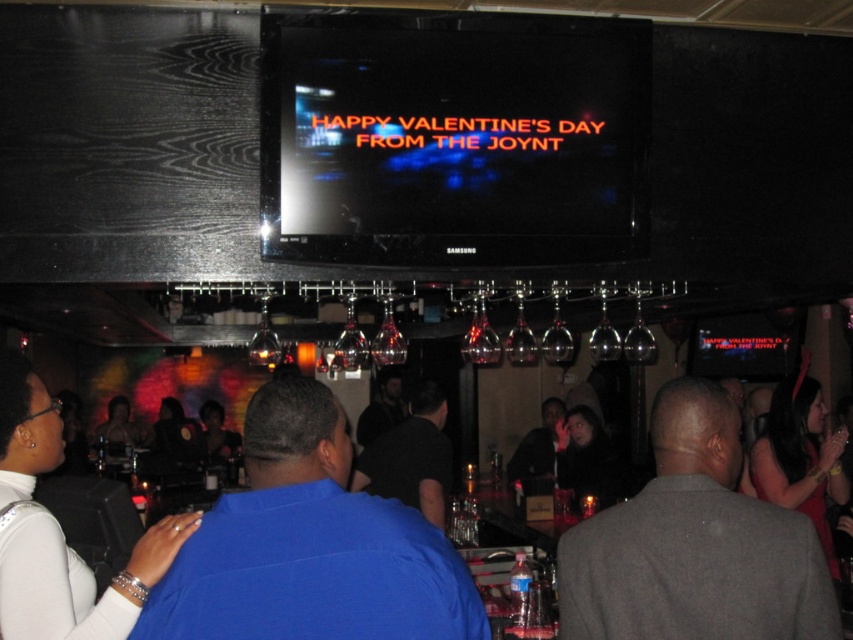
Does point (426, 456) come closer to viewer compared to point (368, 436)?

That is True.

Between black matte shirt at center and dark gray shirt at center, which one is positioned lower?

dark gray shirt at center is lower down.

The width and height of the screenshot is (853, 640). In order to click on black matte shirt at center in this screenshot , I will do `click(410, 458)`.

Can you confirm if blue matte shirt at center is bigger than dark blue shirt at center?

Incorrect, blue matte shirt at center is not larger than dark blue shirt at center.

Is blue matte shirt at center shorter than dark blue shirt at center?

Correct, blue matte shirt at center is not as tall as dark blue shirt at center.

Does point (270, 582) come closer to viewer compared to point (529, 474)?

Yes, it is.

This screenshot has width=853, height=640. I want to click on blue matte shirt at center, so pyautogui.click(x=310, y=545).

Who is positioned more to the right, blue matte shirt at center or black matte shirt at center?

black matte shirt at center

Does blue matte shirt at center have a greater width compared to black matte shirt at center?

Indeed, blue matte shirt at center has a greater width compared to black matte shirt at center.

Between point (161, 634) and point (370, 492), which one is positioned behind?

Positioned behind is point (370, 492).

The width and height of the screenshot is (853, 640). Find the location of `blue matte shirt at center`. blue matte shirt at center is located at coordinates (310, 545).